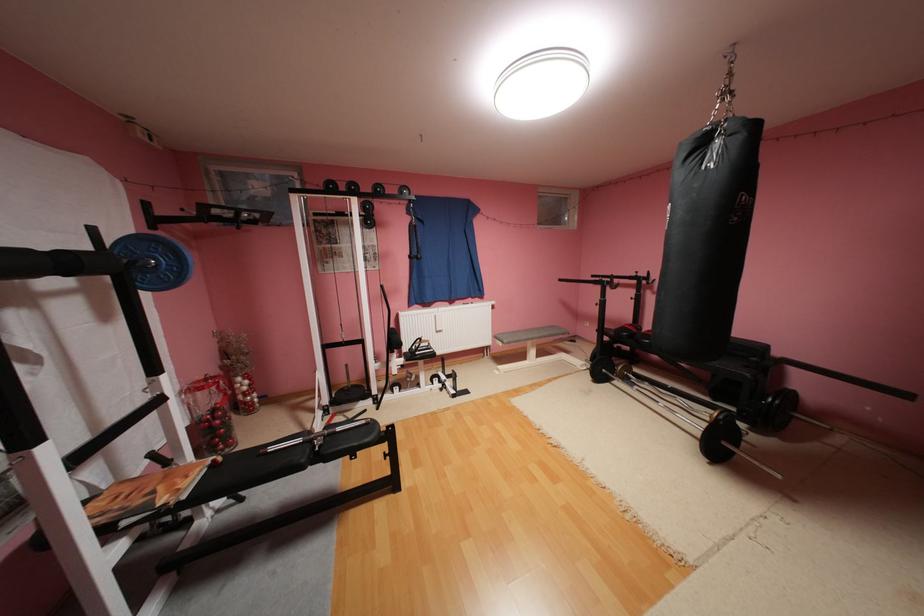
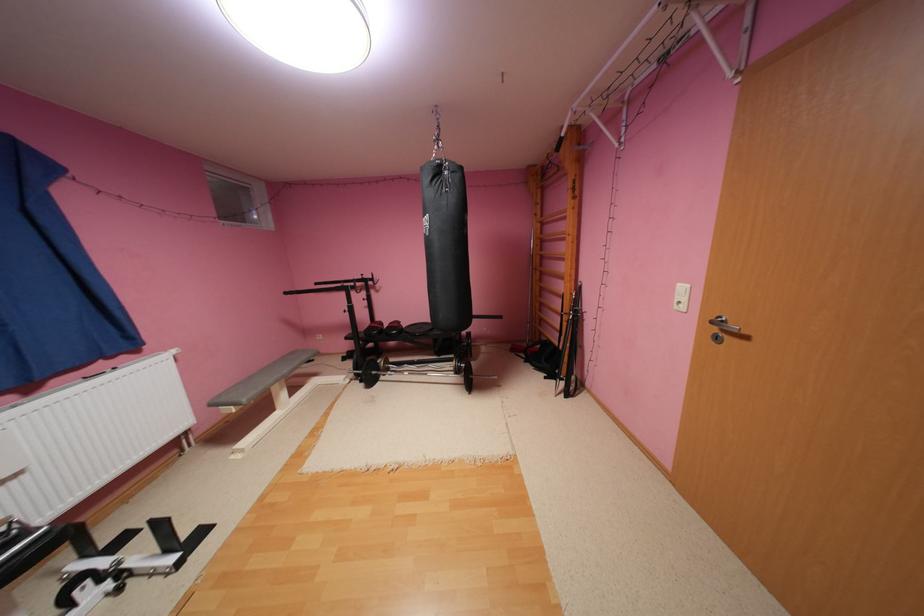
Find the pixel in the second image that matches [569,280] in the first image.

(295, 293)